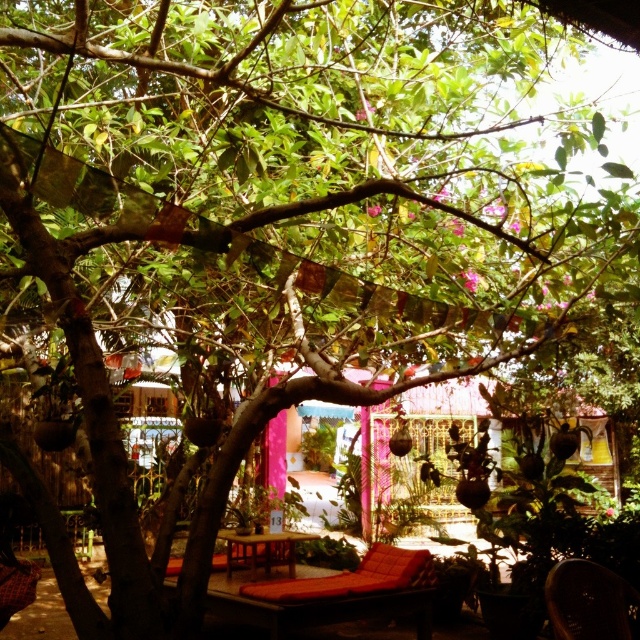
Is metallic gold chair at lower right further to the viewer compared to wooden table at center?

No.

Does metallic gold chair at lower right have a greater width compared to wooden table at center?

Incorrect, metallic gold chair at lower right's width does not surpass wooden table at center's.

Is point (570, 625) positioned in front of point (289, 541)?

Yes, it is in front of point (289, 541).

This screenshot has width=640, height=640. I want to click on metallic gold chair at lower right, so click(588, 602).